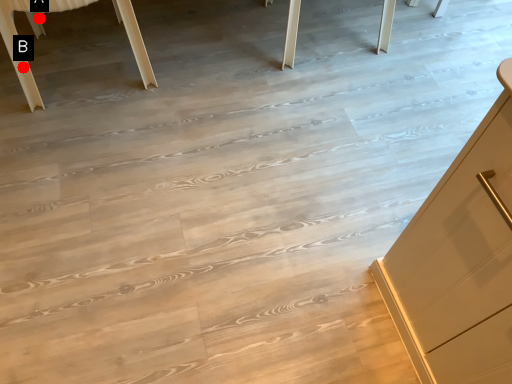
Question: Two points are circled on the image, labeled by A and B beside each circle. Which point is farther from the camera taking this photo?

Choices:
 (A) A is further
 (B) B is further

Answer: (A)